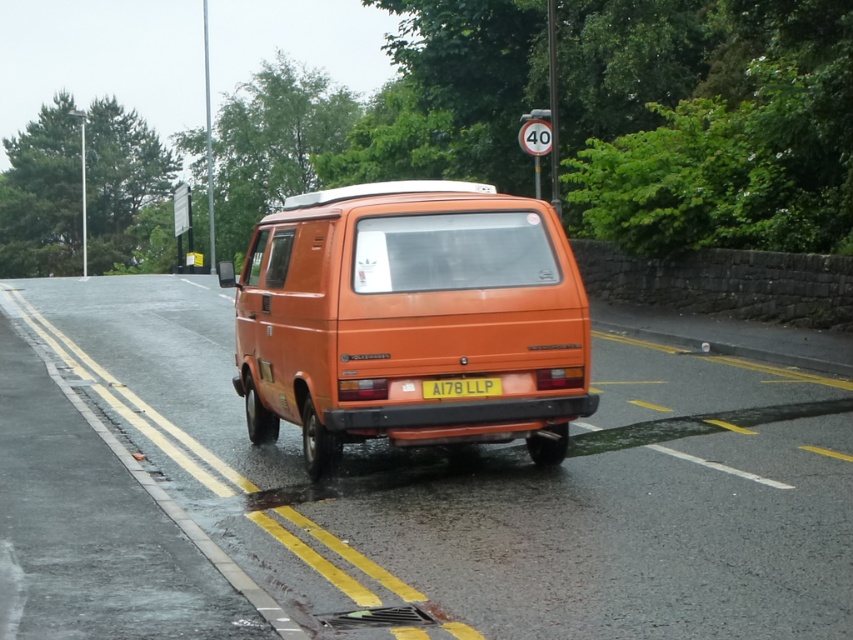
Does orange matte van at center have a larger size compared to yellow matte license plate at center?

Correct, orange matte van at center is larger in size than yellow matte license plate at center.

Does orange matte van at center have a lesser height compared to yellow matte license plate at center?

In fact, orange matte van at center may be taller than yellow matte license plate at center.

Is point (352, 301) farther from camera compared to point (430, 381)?

That is False.

I want to click on orange matte van at center, so (410, 320).